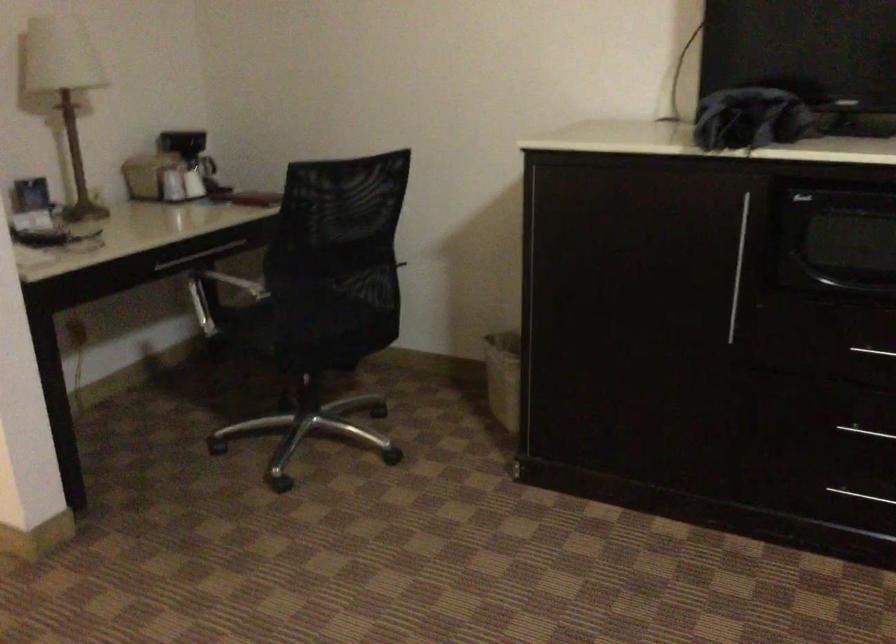
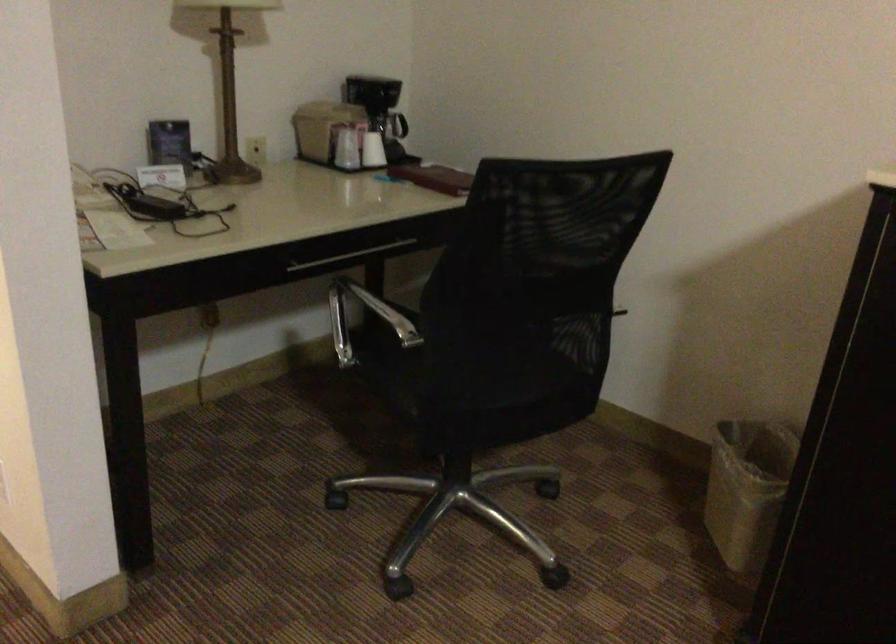
Question: Based on the continuous images, in which direction is the camera rotating? Reply with the corresponding letter.

Choices:
 (A) Left
 (B) Right
 (C) Up
 (D) Down

Answer: (A)